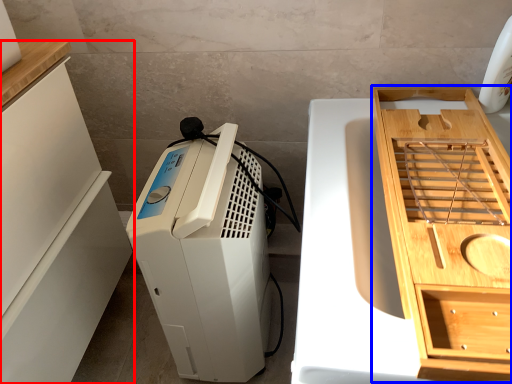
Question: Among these objects, which one is nearest to the camera, cabinetry (highlighted by a red box) or cabinetry (highlighted by a blue box)?

Choices:
 (A) cabinetry
 (B) cabinetry

Answer: (B)